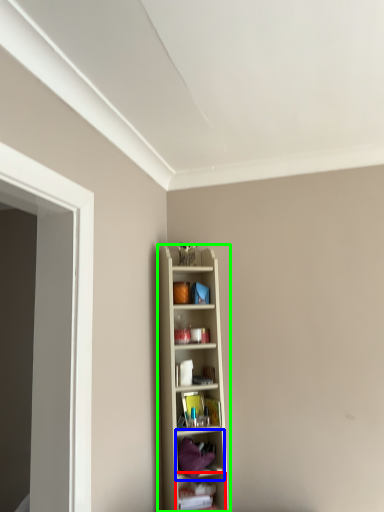
Question: Which object is positioned farthest from shelf (highlighted by a red box)? Select from shelf (highlighted by a blue box) and shelf (highlighted by a green box).

Choices:
 (A) shelf
 (B) shelf

Answer: (B)